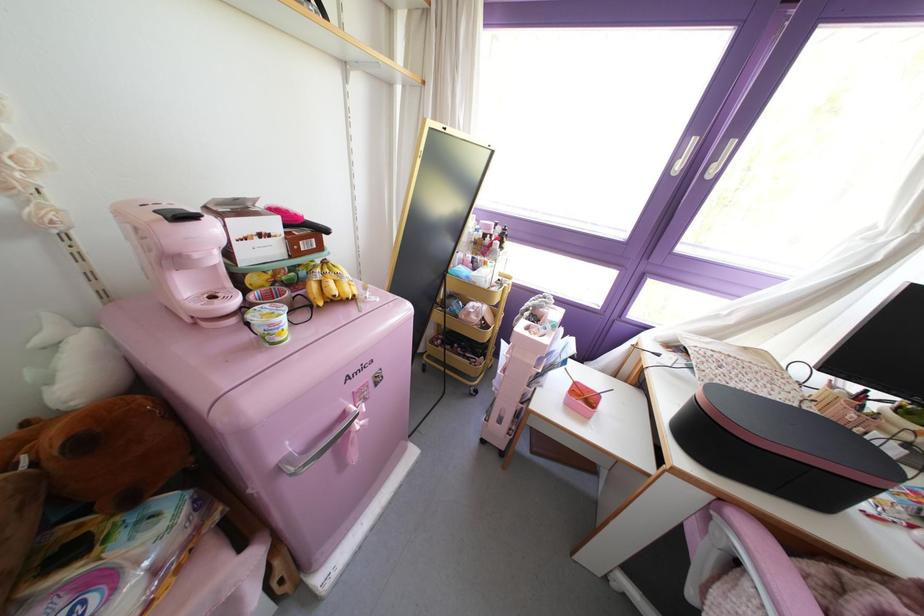
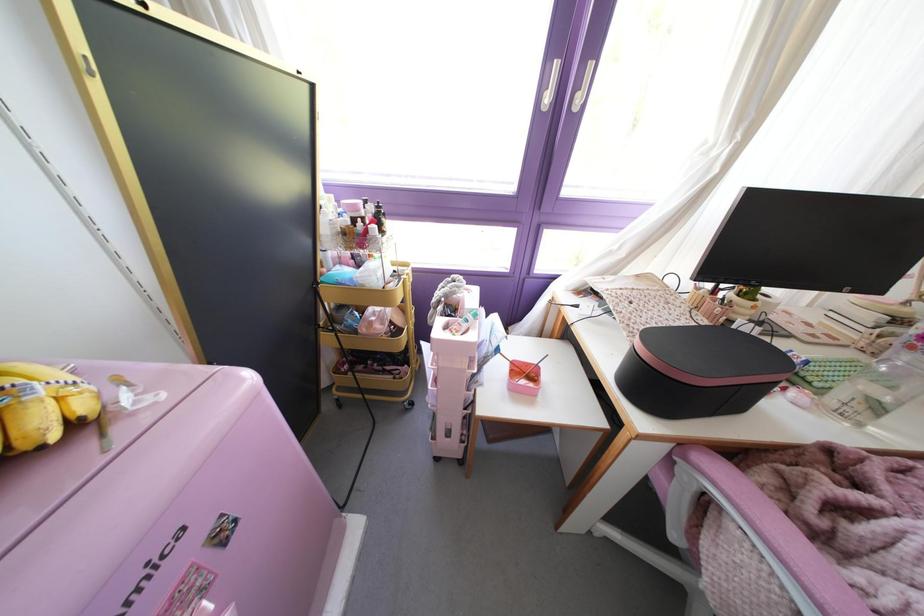
Question: The images are taken continuously from a first-person perspective. In which direction are you moving?

Choices:
 (A) Left
 (B) Right
 (C) Forward
 (D) Backward

Answer: (C)